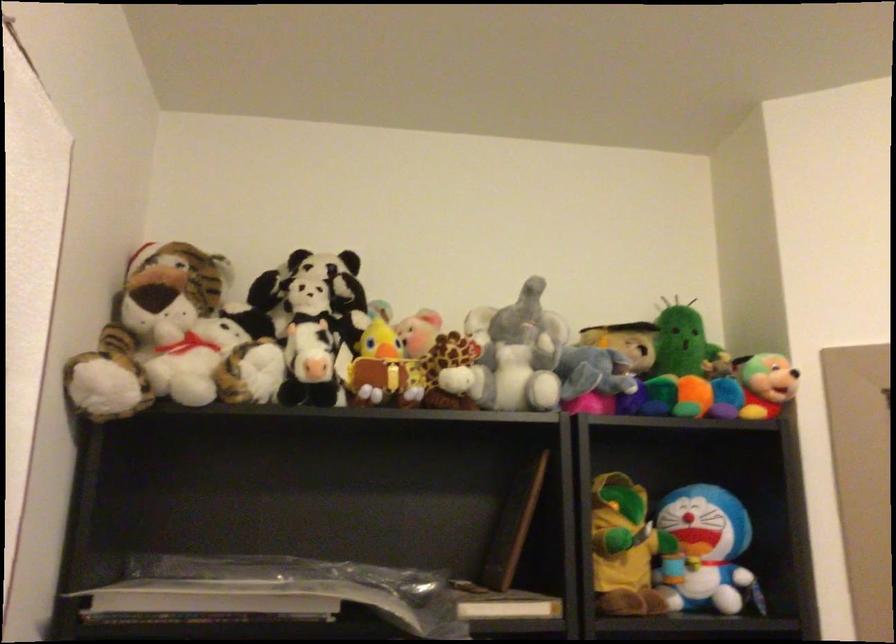
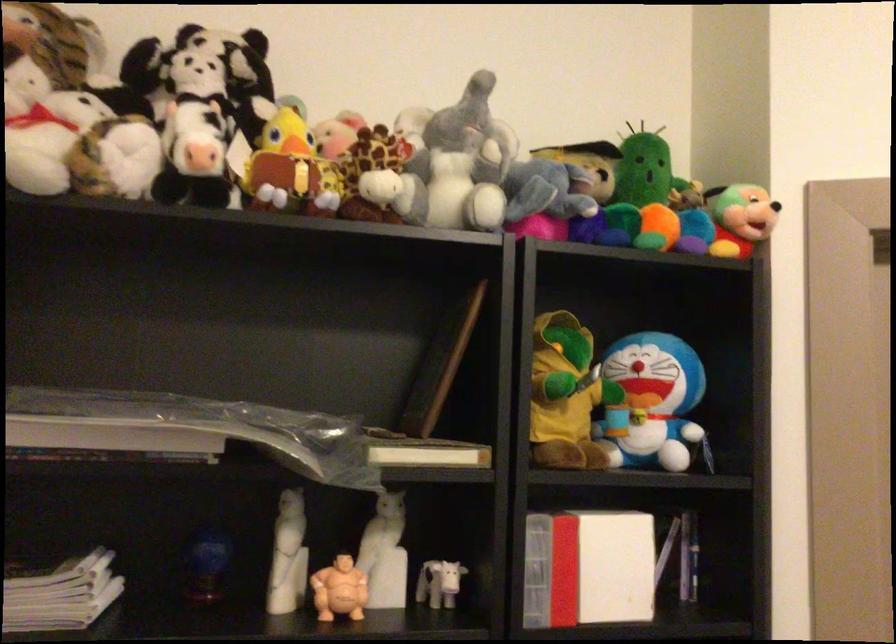
In the second image, find the point that corresponds to the point at 625,550 in the first image.

(565, 395)